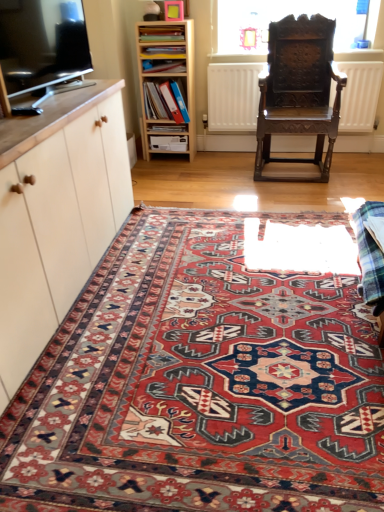
At what (x,y) coordinates should I click in order to perform the action: click on vacant area on top of carpet with intricate patterns at center (from a real-world perspective). Please return your answer as a coordinate pair (x, y). Looking at the image, I should click on (249, 322).